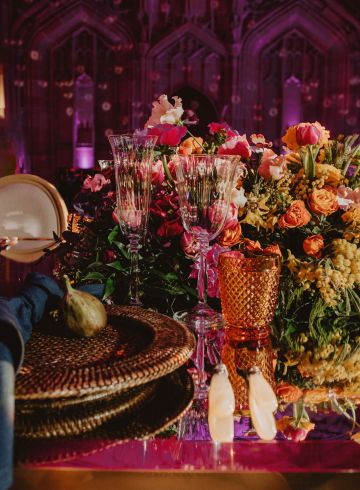
What are the coordinates of `chair` in the screenshot? It's located at [x=17, y=210].